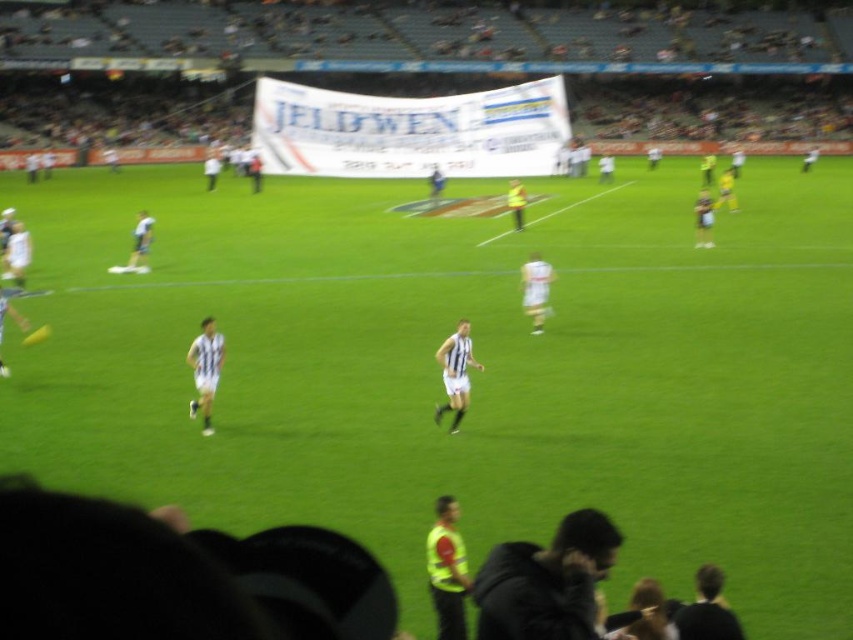
You are a photographer standing at the edge of the field, and you want to capture both the yellow reflective vest at lower center and the yellow reflective vest at center in your photo. Which vest appears larger in the photo?

The yellow reflective vest at lower center appears larger in the photo because it is closer to the camera than the yellow reflective vest at center.

You are a photographer trying to capture the action of the Australian Rules Football match. You notice two points on the field marked as point 1 at coordinates point (x=451, y=566) and point 2 at coordinates point (x=213, y=374). Which point is closer to your camera position?

Point (x=451, y=566) is closer to the camera than point (x=213, y=374).